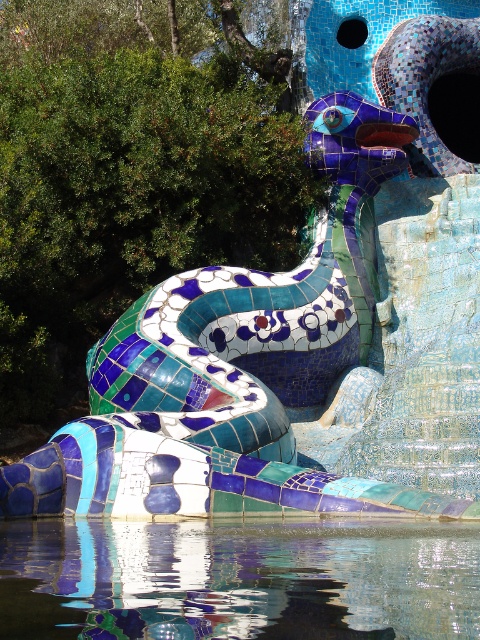
Question: Which point is farther to the camera?

Choices:
 (A) mosaic tile snake at center
 (B) transparent glass water at lower center

Answer: (A)

Question: Which of the following is the closest to the observer?

Choices:
 (A) (467, 529)
 (B) (252, 484)

Answer: (A)

Question: Where is mosaic tile snake at center located in relation to transparent glass water at lower center in the image?

Choices:
 (A) below
 (B) above

Answer: (B)

Question: Where is mosaic tile snake at center located in relation to transparent glass water at lower center in the image?

Choices:
 (A) above
 (B) below

Answer: (A)

Question: Observing the image, what is the correct spatial positioning of mosaic tile snake at center in reference to transparent glass water at lower center?

Choices:
 (A) below
 (B) above

Answer: (B)